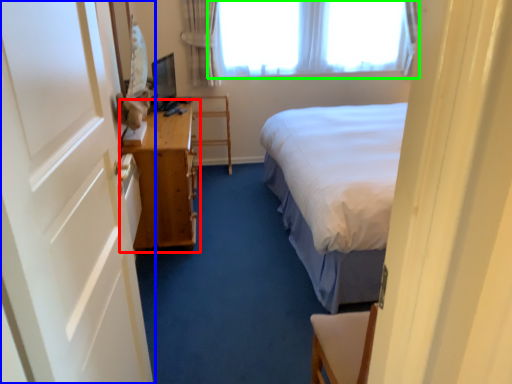
Question: Which object is positioned farthest from table (highlighted by a red box)? Select from door (highlighted by a blue box) and window (highlighted by a green box).

Choices:
 (A) door
 (B) window

Answer: (B)